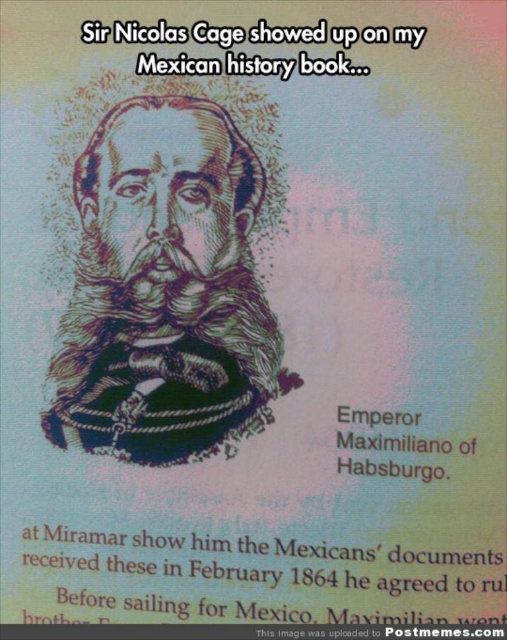
Question: Does brown ink portrait at center come behind white paper text at upper center?

Choices:
 (A) yes
 (B) no

Answer: (A)

Question: From the image, what is the correct spatial relationship of brown textured beard at center in relation to white paper text at upper center?

Choices:
 (A) below
 (B) above

Answer: (A)

Question: Which object is closer to the camera taking this photo?

Choices:
 (A) black paper text at center
 (B) brown textured beard at center

Answer: (A)

Question: Can you confirm if white paper text at upper center is positioned to the right of black paper text at center?

Choices:
 (A) yes
 (B) no

Answer: (B)

Question: Which object is farther from the camera taking this photo?

Choices:
 (A) brown textured beard at center
 (B) brown ink portrait at center

Answer: (A)

Question: Which of the following is the farthest from the observer?

Choices:
 (A) (89, 321)
 (B) (383, 589)
 (C) (162, 36)

Answer: (A)